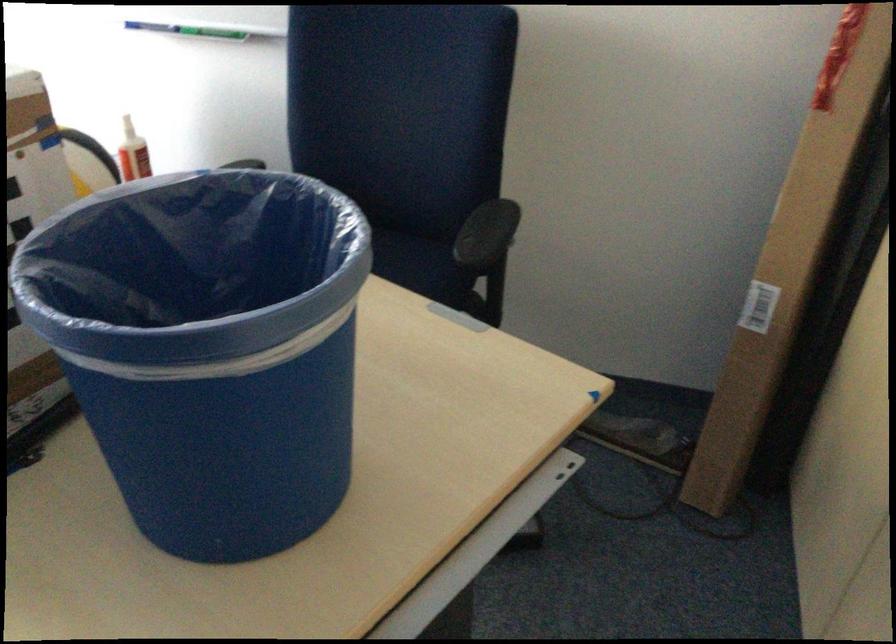
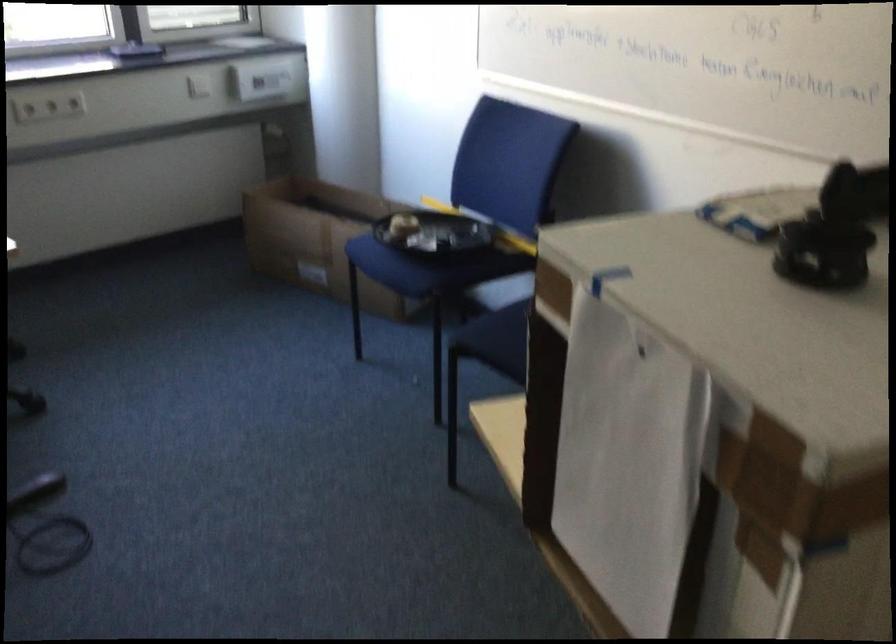
Question: The camera is either moving clockwise (left) or counter-clockwise (right) around the object. The first image is from the beginning of the video and the second image is from the end. Is the camera moving left or right when shooting the video?

Choices:
 (A) Left
 (B) Right

Answer: (B)